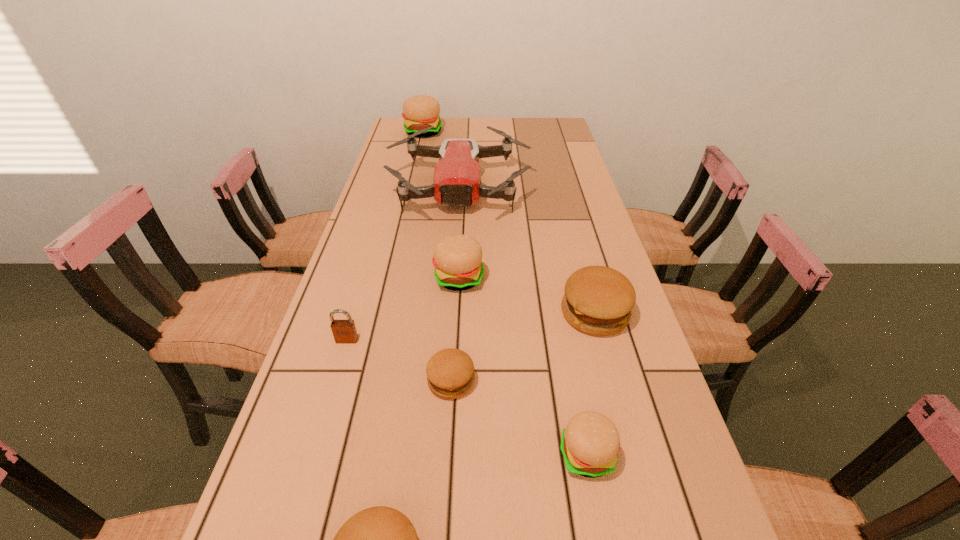
This screenshot has width=960, height=540. Find the location of `the second closest beige hamburger relative to the farthest brown hamburger`. the second closest beige hamburger relative to the farthest brown hamburger is located at coordinates (590, 442).

Image resolution: width=960 pixels, height=540 pixels. Find the location of `the second closest beige hamburger to the red drone`. the second closest beige hamburger to the red drone is located at coordinates (457, 258).

At what (x,y) coordinates should I click in order to perform the action: click on brown hamburger that is the closest to the second beige hamburger from left to right. Please return your answer as a coordinate pair (x, y). Looking at the image, I should click on (598, 300).

Where is `the second closest brown hamburger to the second beige hamburger from left to right`? The width and height of the screenshot is (960, 540). the second closest brown hamburger to the second beige hamburger from left to right is located at coordinates (450, 372).